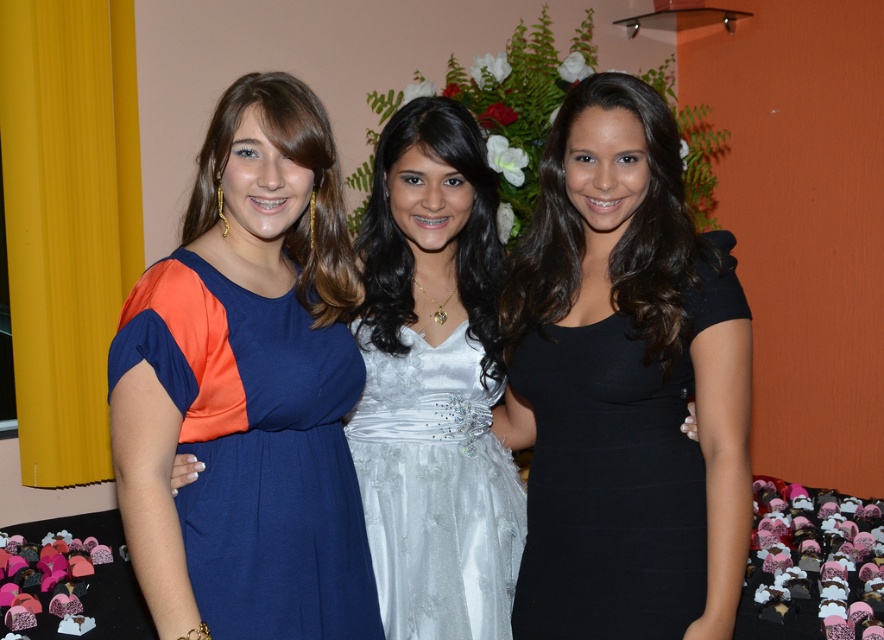
Can you confirm if satin blue dress at center is taller than satin white dress at center?

Indeed, satin blue dress at center has a greater height compared to satin white dress at center.

Does satin blue dress at center appear on the left side of satin white dress at center?

Indeed, satin blue dress at center is positioned on the left side of satin white dress at center.

This screenshot has height=640, width=884. Describe the element at coordinates (249, 387) in the screenshot. I see `satin blue dress at center` at that location.

Locate an element on the screen. satin blue dress at center is located at coordinates (249, 387).

Can you confirm if black matte dress at center is taller than satin white dress at center?

Yes.

Based on the photo, is black matte dress at center positioned at the back of satin white dress at center?

No, black matte dress at center is closer to the viewer.

Who is more distant from viewer, (725, 403) or (493, 403)?

Positioned behind is point (493, 403).

Where is `black matte dress at center`? black matte dress at center is located at coordinates (625, 381).

Is satin blue dress at center thinner than black matte dress at center?

Correct, satin blue dress at center's width is less than black matte dress at center's.

Based on the photo, is satin blue dress at center closer to camera compared to black matte dress at center?

Yes, it is in front of black matte dress at center.

Is point (310, 160) positioned after point (699, 410)?

No, it is in front of (699, 410).

Locate an element on the screen. The height and width of the screenshot is (640, 884). satin blue dress at center is located at coordinates (x=249, y=387).